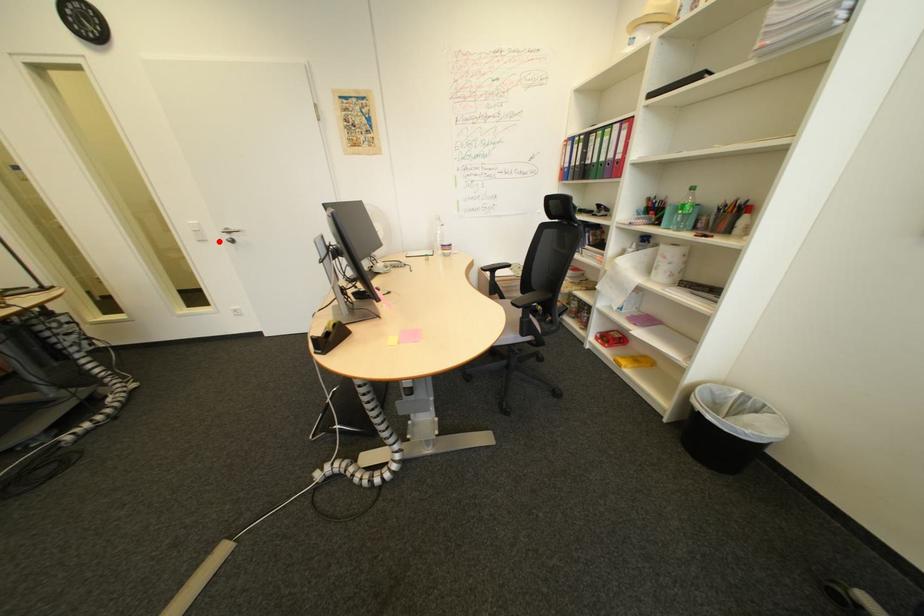
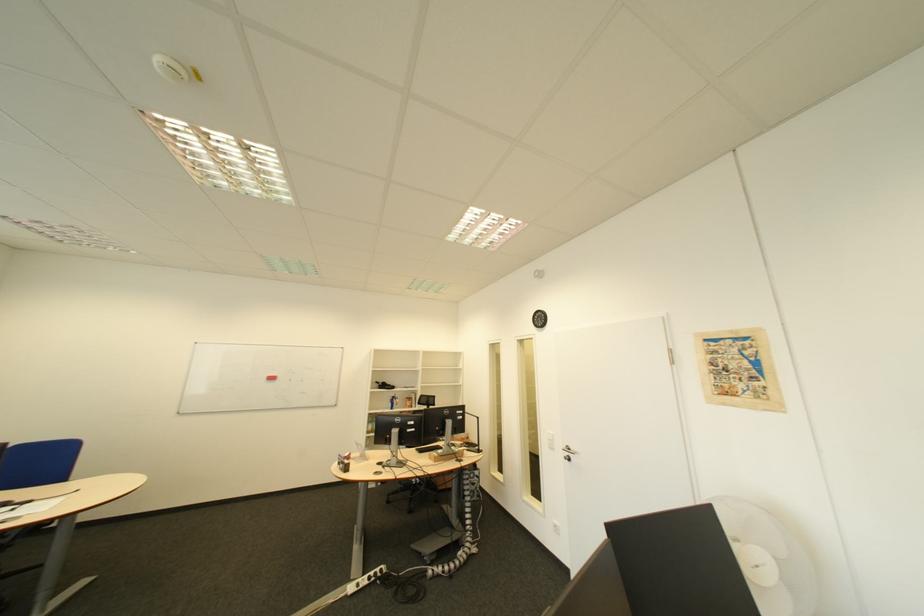
Find the pixel in the second image that matches the highlighted location in the first image.

(565, 451)